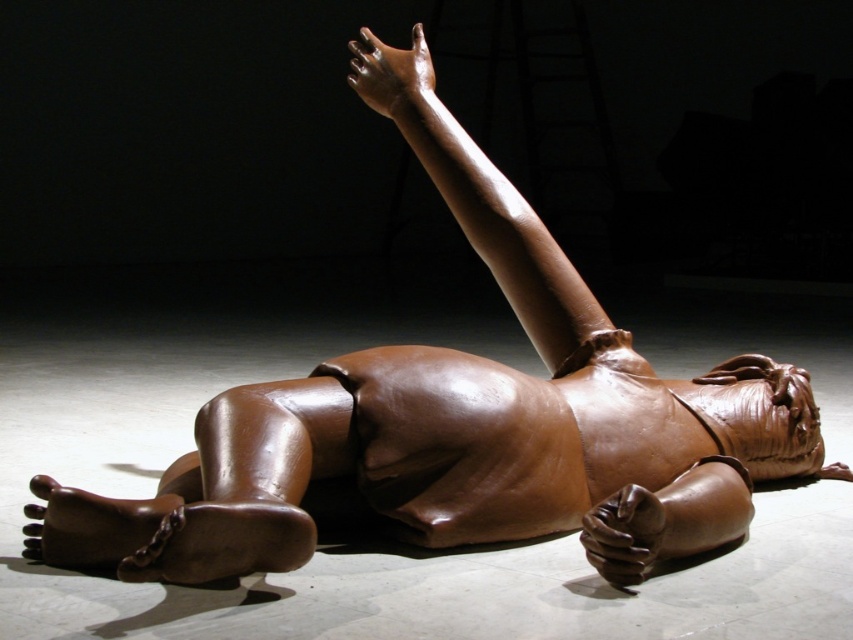
Question: Does shiny brown arm at upper center lie behind shiny brown hand at upper center?

Choices:
 (A) yes
 (B) no

Answer: (A)

Question: Which of the following is the farthest from the observer?

Choices:
 (A) shiny brown arm at upper center
 (B) shiny brown hand at lower right

Answer: (A)

Question: Is shiny brown hand at upper center positioned in front of shiny brown hand at lower right?

Choices:
 (A) yes
 (B) no

Answer: (B)

Question: Which object is the farthest from the shiny brown hand at upper center?

Choices:
 (A) shiny brown arm at upper center
 (B) shiny brown hand at lower right

Answer: (B)

Question: Which of the following is the closest to the observer?

Choices:
 (A) (354, 49)
 (B) (428, 76)

Answer: (A)

Question: Is shiny brown arm at upper center closer to the viewer compared to shiny brown hand at lower right?

Choices:
 (A) no
 (B) yes

Answer: (A)